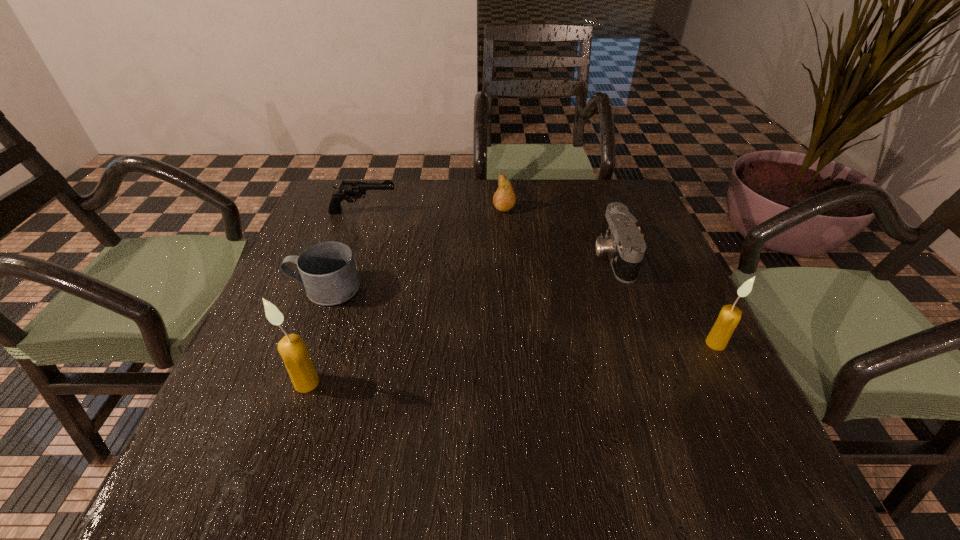
The image size is (960, 540). I want to click on the taller candle, so click(292, 348).

This screenshot has height=540, width=960. In order to click on the left candle in this screenshot , I will do `click(292, 348)`.

Locate an element on the screen. The image size is (960, 540). the second nearest object is located at coordinates (730, 315).

Identify the location of the right candle. Image resolution: width=960 pixels, height=540 pixels. (730, 315).

In order to click on gun in this screenshot , I will do `click(348, 190)`.

Where is `the third object from right to left`? The width and height of the screenshot is (960, 540). the third object from right to left is located at coordinates (504, 199).

Locate an element on the screen. The width and height of the screenshot is (960, 540). the fifth object from left to right is located at coordinates (621, 239).

Identify the location of mug. (327, 270).

This screenshot has height=540, width=960. In order to click on vacant space situated 0.370m on the right of the taller candle in this screenshot , I will do `click(521, 382)`.

Find the location of a particular element. The width and height of the screenshot is (960, 540). vacant space located 0.350m on the back of the right candle is located at coordinates (660, 233).